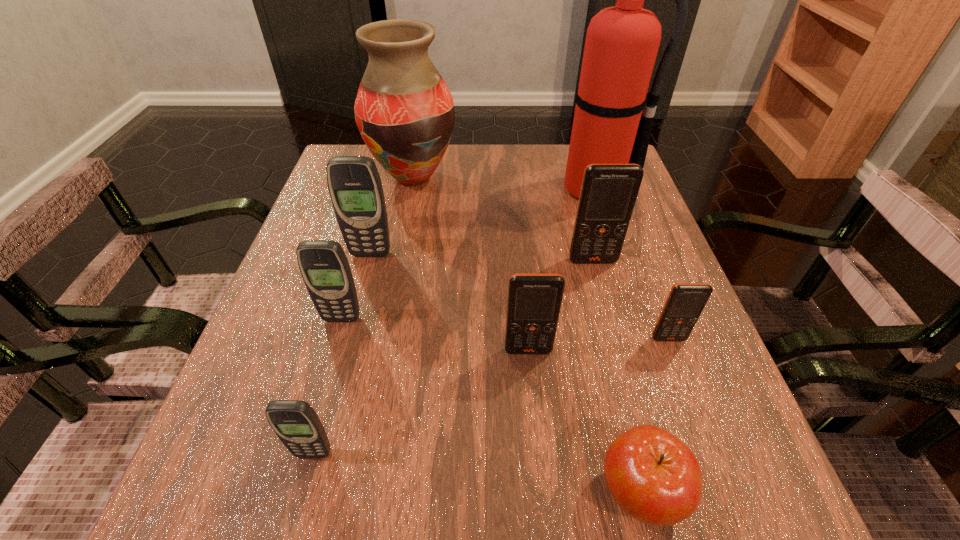
Locate an element on the screen. This screenshot has width=960, height=540. object that stands as the seventh closest to the red fire extinguisher is located at coordinates (654, 477).

Find the location of a particular element. object that is the fifth closest one to the biggest gray cellular telephone is located at coordinates (622, 42).

Locate an element on the screen. Image resolution: width=960 pixels, height=540 pixels. cellular telephone that is the second closest to the red fire extinguisher is located at coordinates (686, 301).

Select which cellular telephone appears as the third closest to the second orange cellular telephone from right to left. Please provide its 2D coordinates. Your answer should be formatted as a tuple, i.e. [(x, y)], where the tuple contains the x and y coordinates of a point satisfying the conditions above.

[(354, 183)]

Locate which orange cellular telephone is the third closest to the farthest gray cellular telephone. Please provide its 2D coordinates. Your answer should be formatted as a tuple, i.e. [(x, y)], where the tuple contains the x and y coordinates of a point satisfying the conditions above.

[(686, 301)]

Select which orange cellular telephone is the second closest to the vase. Please provide its 2D coordinates. Your answer should be formatted as a tuple, i.e. [(x, y)], where the tuple contains the x and y coordinates of a point satisfying the conditions above.

[(534, 301)]

Select which gray cellular telephone is the closest to the vase. Please provide its 2D coordinates. Your answer should be formatted as a tuple, i.e. [(x, y)], where the tuple contains the x and y coordinates of a point satisfying the conditions above.

[(354, 183)]

Find the location of `gray cellular telephone that stands as the second closest to the leftmost orange cellular telephone`. gray cellular telephone that stands as the second closest to the leftmost orange cellular telephone is located at coordinates (295, 422).